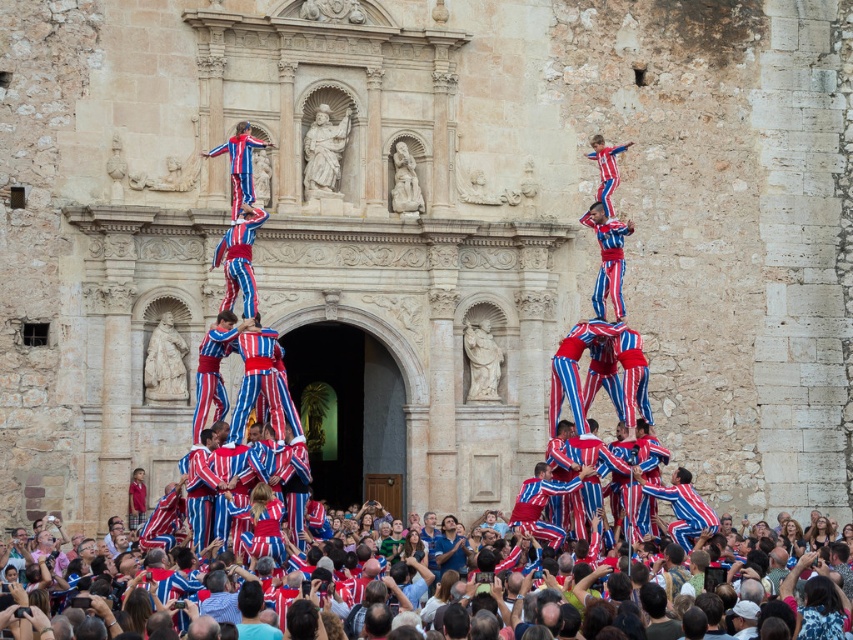
Does matte red fabric at lower center have a larger size compared to matte red and blue striped pants at center?

Yes, matte red fabric at lower center is bigger than matte red and blue striped pants at center.

Between matte red fabric at lower center and matte red and blue striped pants at center, which one appears on the right side from the viewer's perspective?

From the viewer's perspective, matte red fabric at lower center appears more on the right side.

Measure the distance between point (787, 586) and camera.

Point (787, 586) is 59.57 meters from camera.

Locate an element on the screen. This screenshot has width=853, height=640. matte red fabric at lower center is located at coordinates (822, 611).

Can you confirm if matte red fabric at lower center is positioned below matte red and blue striped pants at upper right?

Correct, matte red fabric at lower center is located below matte red and blue striped pants at upper right.

Is point (798, 621) positioned behind point (613, 216)?

No.

Is point (843, 580) in front of point (614, 172)?

Yes, it is in front of point (614, 172).

The image size is (853, 640). I want to click on matte red fabric at lower center, so click(822, 611).

Does point (838, 625) lie behind point (238, 156)?

No, it is in front of (238, 156).

The image size is (853, 640). What do you see at coordinates (822, 611) in the screenshot?
I see `matte red fabric at lower center` at bounding box center [822, 611].

This screenshot has width=853, height=640. What are the coordinates of `matte red fabric at lower center` in the screenshot? It's located at (822, 611).

Find the location of a particular element. The height and width of the screenshot is (640, 853). matte red fabric at lower center is located at coordinates (822, 611).